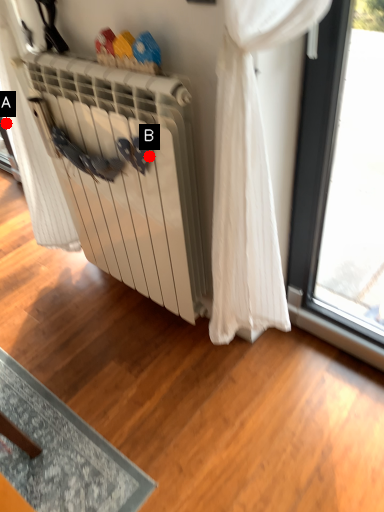
Question: Two points are circled on the image, labeled by A and B beside each circle. Which point is closer to the camera?

Choices:
 (A) A is closer
 (B) B is closer

Answer: (B)